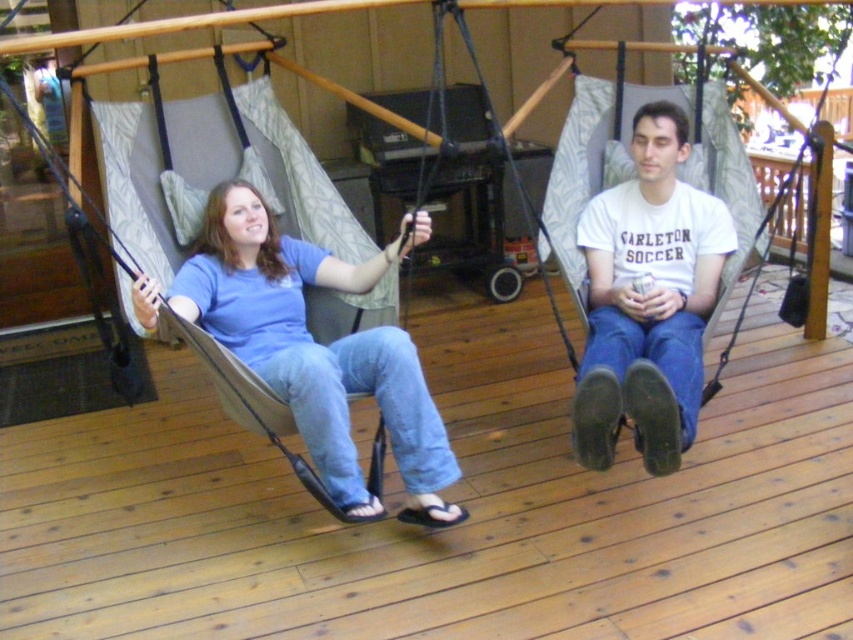
Measure the distance between blue cotton shirt at center and camera.

blue cotton shirt at center is 7.65 feet away from camera.

This screenshot has width=853, height=640. What are the coordinates of `blue cotton shirt at center` in the screenshot? It's located at (318, 348).

Does point (277, 236) lie behind point (618, 230)?

No, (277, 236) is closer to viewer.

The width and height of the screenshot is (853, 640). What are the coordinates of `blue cotton shirt at center` in the screenshot? It's located at (318, 348).

Is the position of wooden deck at center more distant than that of matte gray hammock at left?

No, wooden deck at center is in front of matte gray hammock at left.

Which of these two, wooden deck at center or matte gray hammock at left, stands taller?

With more height is matte gray hammock at left.

Is point (486, 598) in front of point (3, 90)?

No, (486, 598) is further to viewer.

I want to click on wooden deck at center, so click(x=453, y=528).

Between point (637, 611) and point (264, 352), which one is positioned in front?

Positioned in front is point (637, 611).

Measure the distance between point (367, 440) and camera.

A distance of 11.35 feet exists between point (367, 440) and camera.

Is point (67, 432) behind point (351, 356)?

Yes.

This screenshot has width=853, height=640. I want to click on wooden deck at center, so click(x=453, y=528).